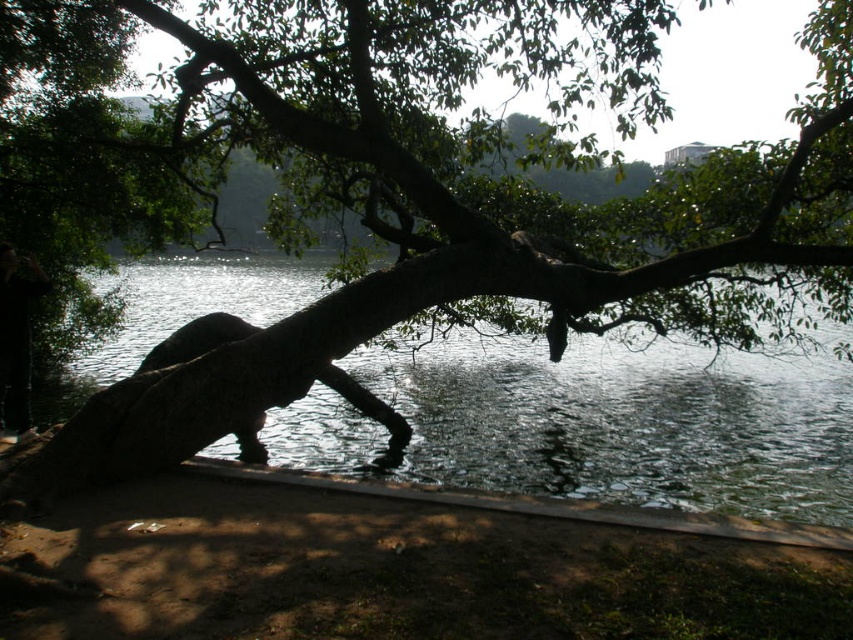
You are standing at the center of the lakeside scene. Which direction should you walk to reach the smooth bark tree trunk at center?

Since the smooth bark tree trunk at center is located at point coordinates, you should walk towards the center of the scene to reach it.

You are standing at the lakeside and see two points marked in the image. Which point is closer to you, point (x=477, y=305) or point (x=9, y=291)?

Point (x=9, y=291) is closer to you because it is closer to the camera than point (x=477, y=305).

Based on the photo, you are standing on the wooden plank at the lakeside and want to take a photo of both the clear water at lower center and the black matte person at left. Which object should you focus on first if you want to ensure both are in sharp focus?

You should focus on the black matte person at left first because it is farther away from the viewer than the clear water at lower center, ensuring the depth of field captures both.